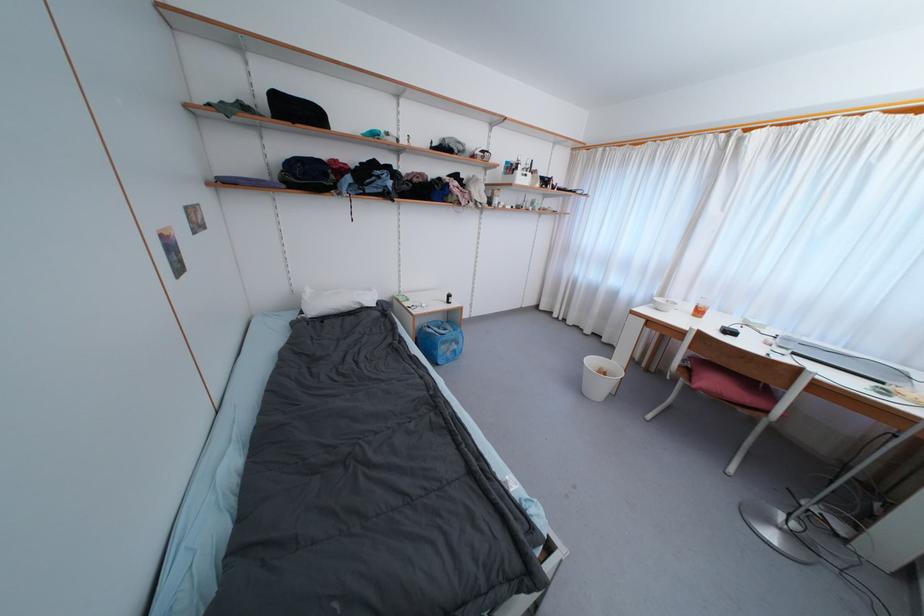
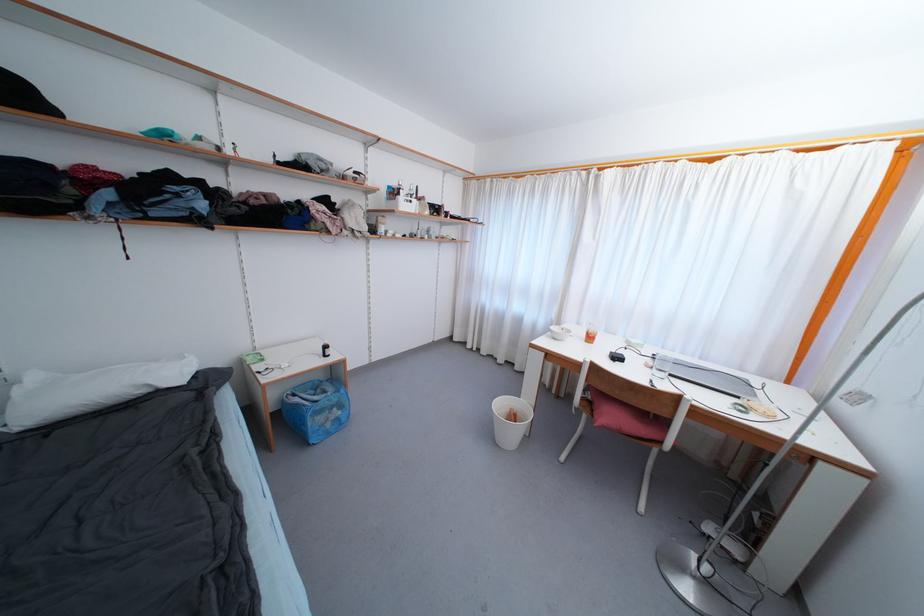
Locate, in the second image, the point that corresponds to pixel 702 315 in the first image.

(593, 341)